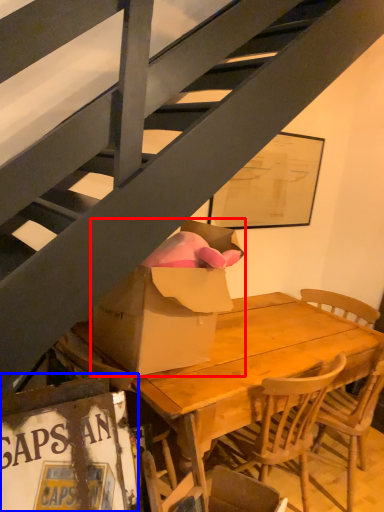
Question: Among these objects, which one is farthest to the camera, box (highlighted by a red box) or picture frame (highlighted by a blue box)?

Choices:
 (A) box
 (B) picture frame

Answer: (A)